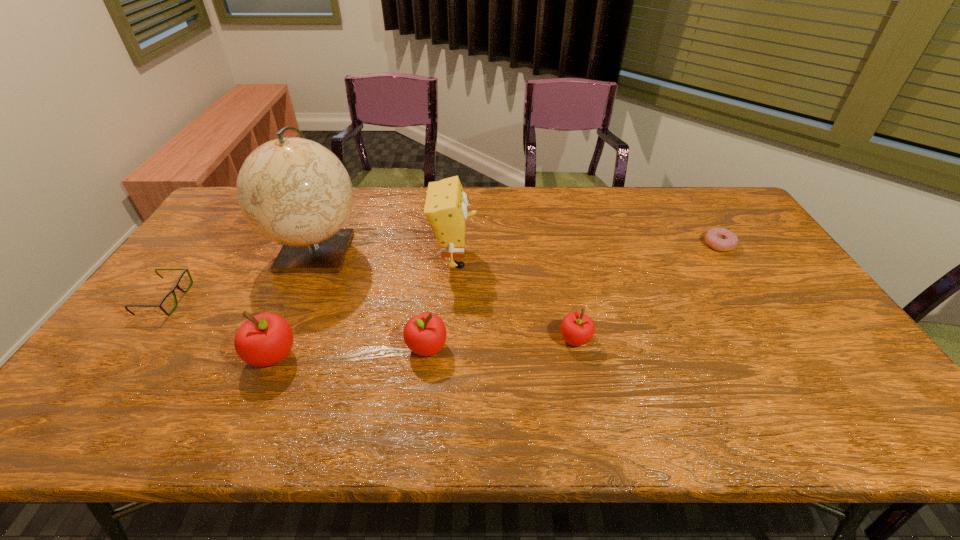
This screenshot has width=960, height=540. Find the location of `free area in between the tallest apple and the spectacles`. free area in between the tallest apple and the spectacles is located at coordinates (219, 327).

Find the location of a particular element. This screenshot has height=540, width=960. free spot between the rightmost object and the second tallest object is located at coordinates 587,252.

What are the coordinates of `free area in between the spectacles and the fourth shortest object` in the screenshot? It's located at (296, 323).

Find the location of a particular element. This screenshot has width=960, height=540. vacant area between the sponge and the shortest apple is located at coordinates (515, 299).

You are a GUI agent. You are given a task and a screenshot of the screen. Output one action in this format:
    pyautogui.click(x=<x>, y=<y>)
    Task: Click on the unoccupied area between the fourth tallest object and the shortest object
    This screenshot has width=960, height=540.
    Given the screenshot: What is the action you would take?
    pyautogui.click(x=573, y=296)

Find the location of a particular element. The width and height of the screenshot is (960, 540). the closest object to the globe is located at coordinates pos(176,285).

Where is `the sixth closest object to the fifth shortest object`? This screenshot has width=960, height=540. the sixth closest object to the fifth shortest object is located at coordinates (720, 239).

This screenshot has height=540, width=960. Identify the location of the closest apple to the shortest object. (577, 329).

Identify which apple is the second closest to the shortest apple. Please provide its 2D coordinates. Your answer should be formatted as a tuple, i.e. [(x, y)], where the tuple contains the x and y coordinates of a point satisfying the conditions above.

[(265, 339)]

The height and width of the screenshot is (540, 960). Identify the location of vacant region that satisfies the following two spatial constraints: 1. on the lens of the spectacles; 2. on the right side of the rightmost apple. (135, 340).